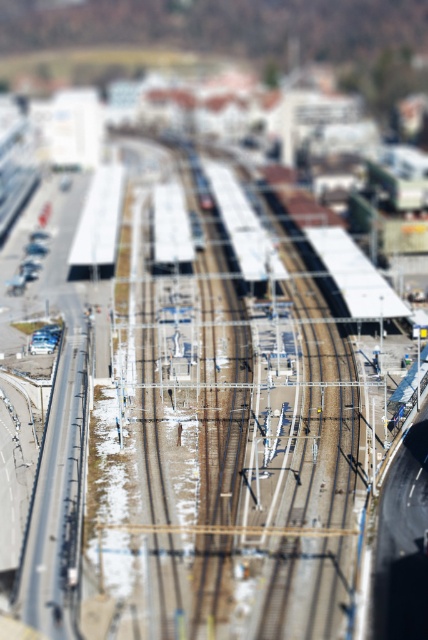
Question: Does white metallic train at center appear under white matte platform at left?

Choices:
 (A) no
 (B) yes

Answer: (B)

Question: Is white metallic train at center wider than white matte platform at left?

Choices:
 (A) yes
 (B) no

Answer: (A)

Question: Among these points, which one is nearest to the camera?

Choices:
 (A) (237, 220)
 (B) (86, 221)

Answer: (B)

Question: Does white metallic train at center appear on the right side of white matte platform at left?

Choices:
 (A) no
 (B) yes

Answer: (B)

Question: Among these points, which one is farthest from the camera?

Choices:
 (A) (91, 248)
 (B) (231, 188)

Answer: (B)